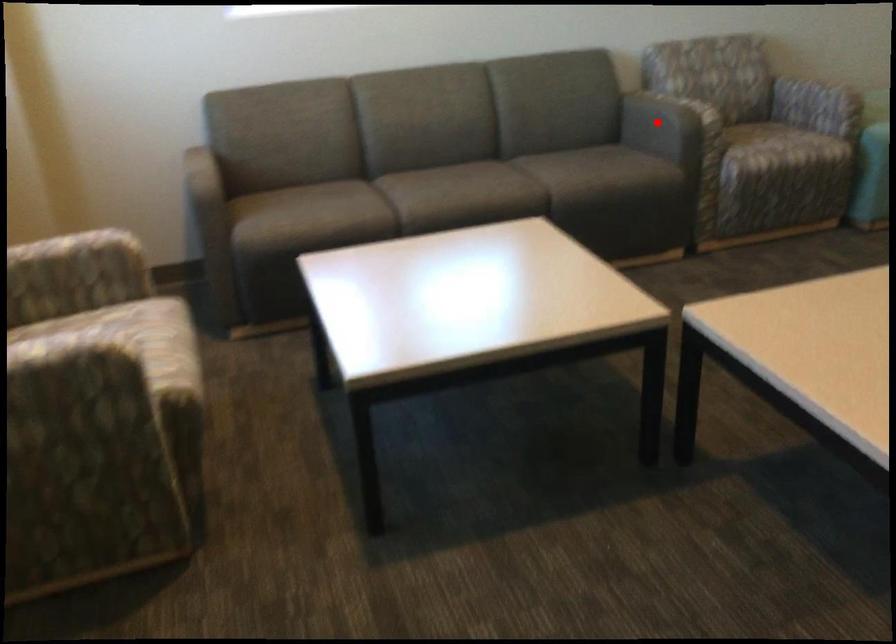
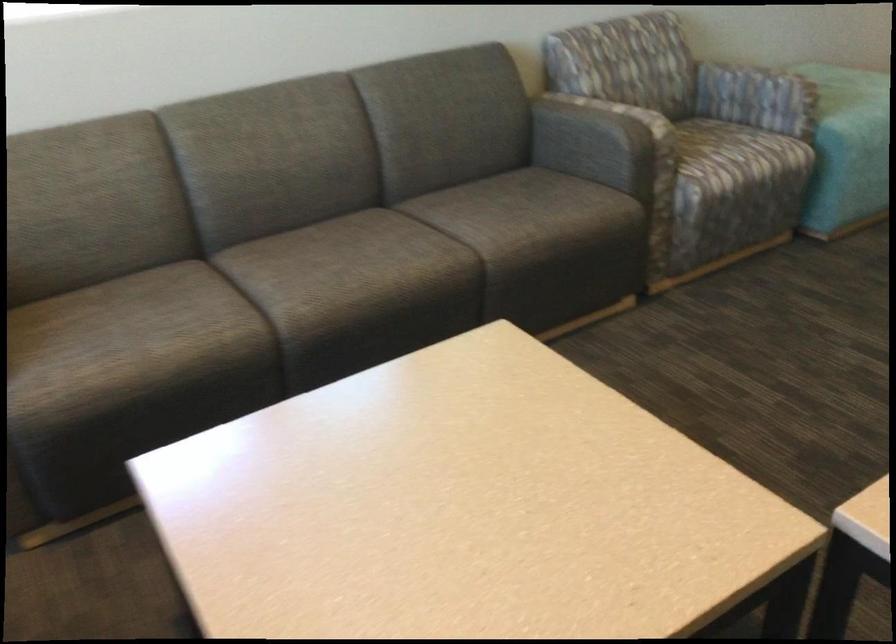
Locate, in the second image, the point that corresponds to the highlighted location in the first image.

(597, 140)